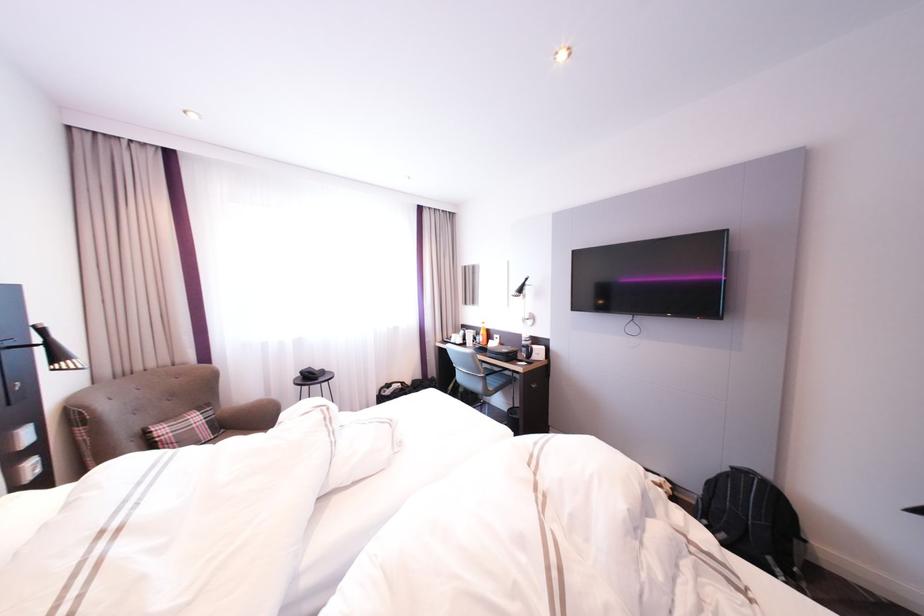
Where is `brown chair sitting surface`? The height and width of the screenshot is (616, 924). brown chair sitting surface is located at coordinates (232, 435).